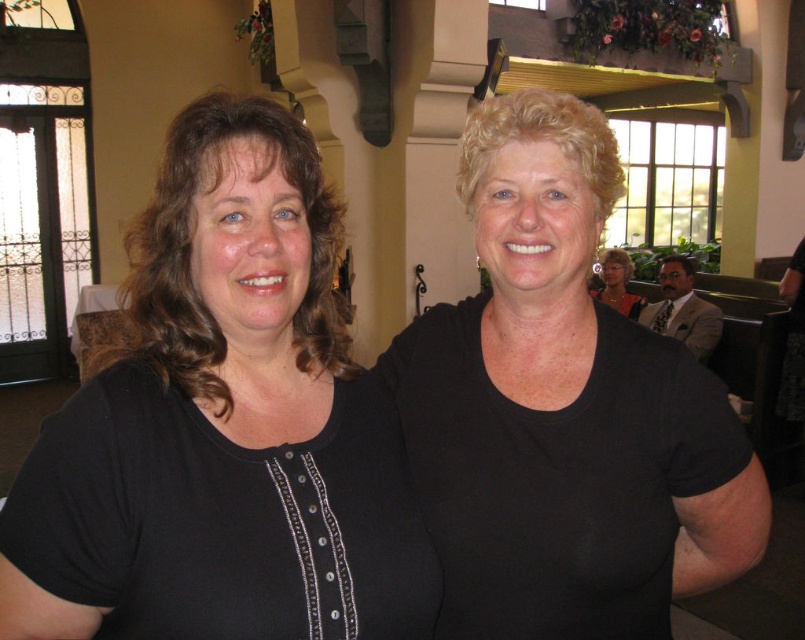
You are a photographer trying to capture a clear photo of both the black knit shirt at center and the matte black shirt at center. Since you can only focus on one object at a time, which one should you focus on to ensure the other is still somewhat in focus?

You should focus on the black knit shirt at center because it is closer to the viewer than the matte black shirt at center. By focusing on the closer object, the depth of field may still keep the farther matte black shirt at center somewhat in focus.

You are a photographer trying to capture both the black matte shirt at upper right and the matte black shirt at center in a single frame. Which shirt should you focus on first to ensure both are in the shot?

The black matte shirt at upper right is positioned under the matte black shirt at center, so you should focus on the matte black shirt at center first to ensure both are in the shot.

You are at a social event and want to greet the person wearing the black knit shirt at center. Since you are facing the image, which direction should you turn to approach them first before moving to the black matte shirt at upper right?

The black knit shirt at center is to the left of the black matte shirt at upper right, so you should turn to your left to approach the black knit shirt at center first.